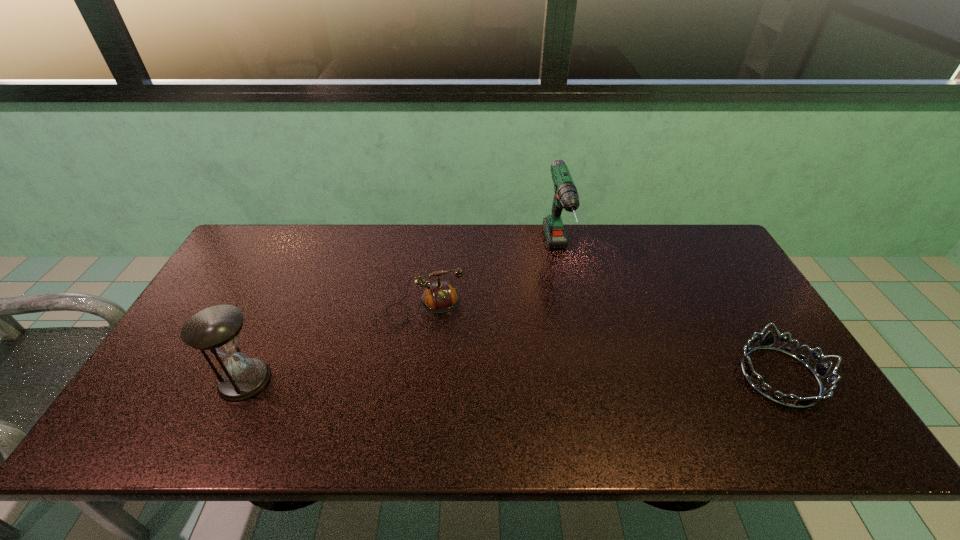
In order to click on vacant position in the image that satisfies the following two spatial constraints: 1. on the front side of the rightmost object; 2. on the front-facing side of the telephone in this screenshot , I will do `click(411, 376)`.

At what (x,y) coordinates should I click in order to perform the action: click on vacant space that satisfies the following two spatial constraints: 1. on the front side of the tiara; 2. on the front-facing side of the drill. Please return your answer as a coordinate pair (x, y). Looking at the image, I should click on (583, 376).